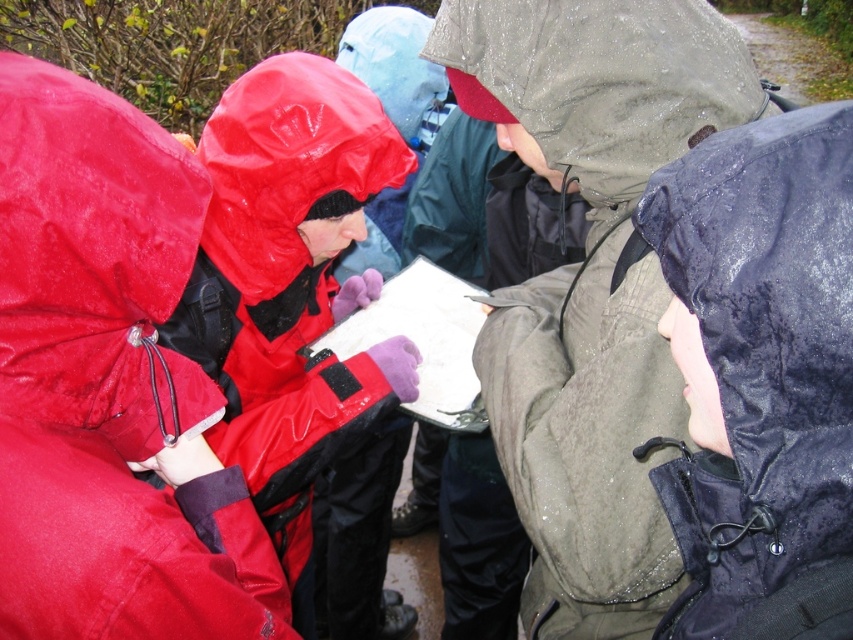
Question: Which point is farther from the camera taking this photo?

Choices:
 (A) (138, 627)
 (B) (596, 316)
 (C) (827, 552)

Answer: (B)

Question: Is shiny red jacket at left positioned behind matte green jacket at center?

Choices:
 (A) yes
 (B) no

Answer: (B)

Question: Which object is farther from the camera taking this photo?

Choices:
 (A) matte green jacket at center
 (B) shiny red jacket at left
 (C) rubberized red jacket at left
 (D) shiny dark blue jacket at lower right

Answer: (C)

Question: Among these points, which one is farthest from the camera?

Choices:
 (A) (641, 211)
 (B) (198, 520)
 (C) (340, 88)

Answer: (C)

Question: Is matte green jacket at center closer to camera compared to rubberized red jacket at left?

Choices:
 (A) no
 (B) yes

Answer: (B)

Question: Is matte green jacket at center above rubberized red jacket at left?

Choices:
 (A) no
 (B) yes

Answer: (B)